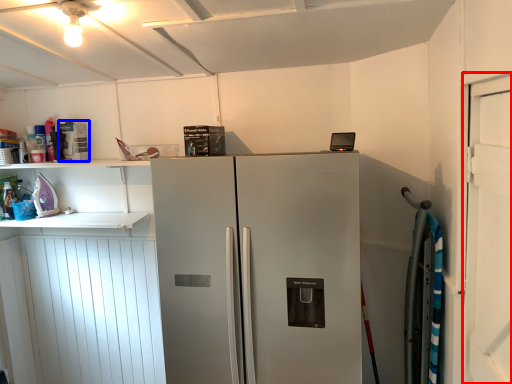
Question: Which object appears farthest to the camera in this image, door (highlighted by a red box) or appliance (highlighted by a blue box)?

Choices:
 (A) door
 (B) appliance

Answer: (B)